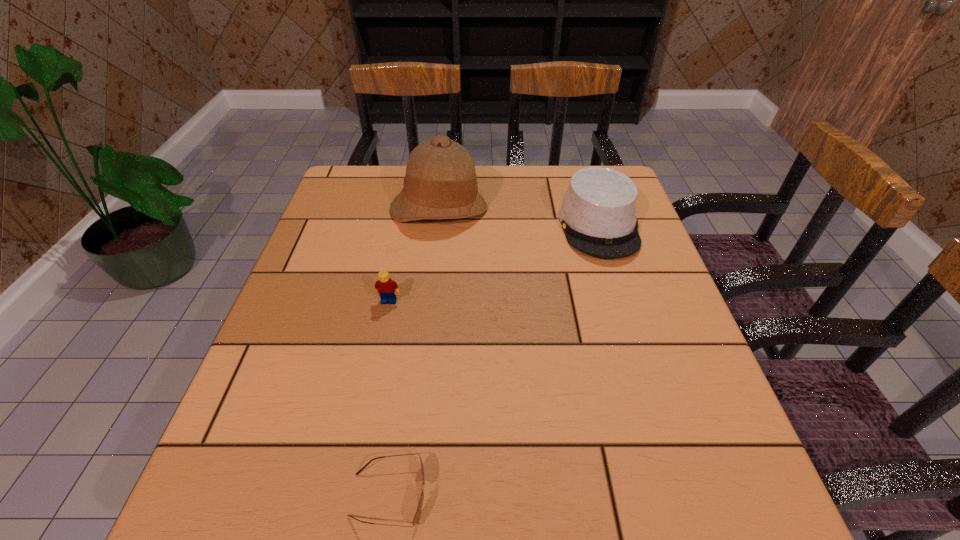
At what (x,y) coordinates should I click in order to perform the action: click on vacant space located 0.110m on the front-facing side of the third farthest object. Please return your answer as a coordinate pair (x, y). Looking at the image, I should click on (380, 345).

Identify the location of vacant region located 0.330m on the front-facing side of the nearest object. (639, 495).

Locate an element on the screen. object at the near edge is located at coordinates (419, 508).

You are a GUI agent. You are given a task and a screenshot of the screen. Output one action in this format:
    pyautogui.click(x=<x>, y=<y>)
    Task: Click on the object at the right edge
    
    Given the screenshot: What is the action you would take?
    pyautogui.click(x=598, y=213)

At what (x,y) coordinates should I click in order to perform the action: click on object located in the far right corner section of the desktop. Please return your answer as a coordinate pair (x, y). Looking at the image, I should click on (598, 213).

The height and width of the screenshot is (540, 960). I want to click on vacant space at the far edge, so click(546, 174).

You are a GUI agent. You are given a task and a screenshot of the screen. Output one action in this format:
    pyautogui.click(x=<x>, y=<y>)
    Task: Click on the free space at the near edge of the desktop
    The height and width of the screenshot is (540, 960).
    Given the screenshot: What is the action you would take?
    652,505

This screenshot has width=960, height=540. I want to click on vacant space at the left edge of the desktop, so click(327, 334).

Find the location of a particular element. The height and width of the screenshot is (540, 960). free space at the right edge of the desktop is located at coordinates (649, 264).

Where is `blank space at the far left corner`? The height and width of the screenshot is (540, 960). blank space at the far left corner is located at coordinates (352, 186).